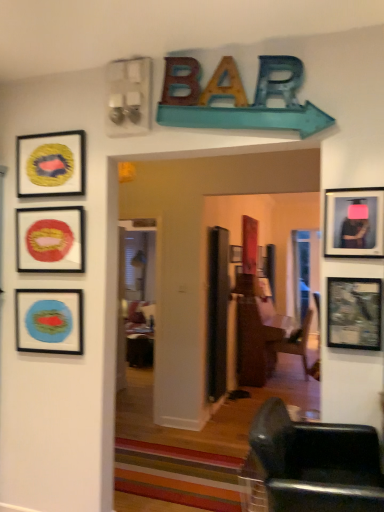
Image resolution: width=384 pixels, height=512 pixels. What are the coordinates of `matte red circular object at upper left, the 2th picture frame in the left-to-right sequence` in the screenshot? It's located at (50, 240).

You are a GUI agent. You are given a task and a screenshot of the screen. Output one action in this format:
    pyautogui.click(x=<x>, y=<y>)
    Task: Click on the matte black picture frame at center, which is counted as the first picture frame, starting from the back
    This screenshot has width=384, height=512.
    Given the screenshot: What is the action you would take?
    pyautogui.click(x=235, y=254)

Locate an element on the screen. wooden framed map at right, positioned as the fifth picture frame in left-to-right order is located at coordinates pyautogui.click(x=354, y=313).

Where is `matte red circular object at upper left, which is the 5th picture frame in right-to-left order`? The height and width of the screenshot is (512, 384). matte red circular object at upper left, which is the 5th picture frame in right-to-left order is located at coordinates (50, 240).

Which is less distant, (289, 470) or (221, 475)?

The point (289, 470) is closer.

Considering the sizes of objects black leather chair at lower right and wooden striped rug at center in the image provided, who is wider, black leather chair at lower right or wooden striped rug at center?

wooden striped rug at center.

From the picture: Is black leather chair at lower right bigger or smaller than wooden striped rug at center?

black leather chair at lower right is bigger than wooden striped rug at center.

In the scene shown: Does black leather chair at lower right turn towards wooden striped rug at center?

No, black leather chair at lower right is not oriented towards wooden striped rug at center.

Is brown wooden door at center far from matte blue picture frame at left, acting as the fourth picture frame starting from the front?

That's right, there is a large distance between brown wooden door at center and matte blue picture frame at left, acting as the fourth picture frame starting from the front.

Where is `door located underneath the matte blue picture frame at left, acting as the fourth picture frame starting from the front (from a real-world perspective)`? This screenshot has height=512, width=384. door located underneath the matte blue picture frame at left, acting as the fourth picture frame starting from the front (from a real-world perspective) is located at coordinates (217, 312).

Who is smaller, brown wooden door at center or matte blue picture frame at left, arranged as the first picture frame when viewed from the left?

matte blue picture frame at left, arranged as the first picture frame when viewed from the left, is smaller.

From a real-world perspective, which object rests below the other?

In real-world perspective, brown wooden door at center is lower.

Can you confirm if metallic silver television at right, which is counted as the 6th picture frame, starting from the back, is bigger than black leather chair at lower right?

Incorrect, metallic silver television at right, which is counted as the 6th picture frame, starting from the back, is not larger than black leather chair at lower right.

Is metallic silver television at right, which appears as the 6th picture frame when viewed from the left, at the left side of black leather chair at lower right?

Incorrect, metallic silver television at right, which appears as the 6th picture frame when viewed from the left, is not on the left side of black leather chair at lower right.

Does metallic silver television at right, the 1th picture frame when ordered from right to left, turn towards black leather chair at lower right?

No, metallic silver television at right, the 1th picture frame when ordered from right to left, is not facing towards black leather chair at lower right.

Considering the positions of objects black leather chair at lower right and yellow matte painting at upper left, positioned as the 3th picture frame in left-to-right order, in the image provided, who is behind, black leather chair at lower right or yellow matte painting at upper left, positioned as the 3th picture frame in left-to-right order,?

yellow matte painting at upper left, positioned as the 3th picture frame in left-to-right order, is behind.

Is black leather chair at lower right with yellow matte painting at upper left, positioned as the 3th picture frame in left-to-right order?

They are not placed beside each other.

Is black leather chair at lower right completely or partially outside of yellow matte painting at upper left, which is counted as the 4th picture frame, starting from the right?

Indeed, black leather chair at lower right is completely outside yellow matte painting at upper left, which is counted as the 4th picture frame, starting from the right.

How different are the orientations of black leather chair at lower right and yellow matte painting at upper left, which is counted as the 4th picture frame, starting from the right, in degrees?

The angular difference between black leather chair at lower right and yellow matte painting at upper left, which is counted as the 4th picture frame, starting from the right, is 90 degrees.

Considering the relative positions of transparent glass door at center and matte blue picture frame at left, arranged as the first picture frame when viewed from the left, in the image provided, is transparent glass door at center to the right of matte blue picture frame at left, arranged as the first picture frame when viewed from the left, from the viewer's perspective?

Yes, transparent glass door at center is to the right of matte blue picture frame at left, arranged as the first picture frame when viewed from the left.

From the image's perspective, is transparent glass door at center over matte blue picture frame at left, arranged as the first picture frame when viewed from the left?

No.

Is transparent glass door at center oriented towards matte blue picture frame at left, positioned as the sixth picture frame in right-to-left order?

Yes, transparent glass door at center is aimed at matte blue picture frame at left, positioned as the sixth picture frame in right-to-left order.

In terms of height, does transparent glass door at center look taller or shorter compared to matte blue picture frame at left, arranged as the first picture frame when viewed from the left?

Clearly, transparent glass door at center is taller compared to matte blue picture frame at left, arranged as the first picture frame when viewed from the left.

Is matte red circular object at upper left, which is the 4th picture frame from back to front, oriented away from brown wooden door at center?

Yes, brown wooden door at center is at the back of matte red circular object at upper left, which is the 4th picture frame from back to front.

What's the angular difference between matte red circular object at upper left, which is the 4th picture frame from back to front, and brown wooden door at center's facing directions?

The facing directions of matte red circular object at upper left, which is the 4th picture frame from back to front, and brown wooden door at center are 91.2 degrees apart.

Which is in front, matte red circular object at upper left, arranged as the 3th picture frame when viewed from the front, or brown wooden door at center?

matte red circular object at upper left, arranged as the 3th picture frame when viewed from the front.

Can you confirm if matte red circular object at upper left, which is the 4th picture frame from back to front, is bigger than brown wooden door at center?

Incorrect, matte red circular object at upper left, which is the 4th picture frame from back to front, is not larger than brown wooden door at center.

Does point (45, 336) lie behind point (381, 480)?

Yes, point (45, 336) is farther from viewer.

Is matte blue picture frame at left, acting as the fourth picture frame starting from the front, smaller than black leather chair at lower right?

Correct, matte blue picture frame at left, acting as the fourth picture frame starting from the front, occupies less space than black leather chair at lower right.

Is matte blue picture frame at left, positioned as the sixth picture frame in right-to-left order, in contact with black leather chair at lower right?

No, matte blue picture frame at left, positioned as the sixth picture frame in right-to-left order, is not in contact with black leather chair at lower right.

Where is `plain lying behind the black leather chair at lower right`? plain lying behind the black leather chair at lower right is located at coordinates (177, 475).

From the brown wooden door at center, count the 3rd picture frame to the left and point to it. Please provide its 2D coordinates.

[(49, 321)]

Which object lies nearer to the anchor point transparent glass door at center, wooden striped rug at center or brown wooden door at center?

Based on the image, brown wooden door at center appears to be nearer to transparent glass door at center.

From the image, which object appears to be nearer to transparent glass door at center, matte red circular object at upper left, which is the 5th picture frame in right-to-left order, or metallic silver television at right, the 1th picture frame in the front-to-back sequence?

matte red circular object at upper left, which is the 5th picture frame in right-to-left order, is closer to transparent glass door at center.

Which object lies further to the anchor point black leather chair at lower right, brown wooden door at center or matte red circular object at upper left, arranged as the 3th picture frame when viewed from the front?

brown wooden door at center is further to black leather chair at lower right.

When comparing their distances from matte blue picture frame at left, acting as the fourth picture frame starting from the front, does transparent glass door at center or wooden striped rug at center seem further?

transparent glass door at center is positioned further to the anchor matte blue picture frame at left, acting as the fourth picture frame starting from the front.

Looking at the image, which one is located closer to wooden striped rug at center, metallic silver television at right, the 1th picture frame when ordered from right to left, or matte blue picture frame at left, positioned as the sixth picture frame in right-to-left order?

matte blue picture frame at left, positioned as the sixth picture frame in right-to-left order, lies closer to wooden striped rug at center than the other object.

Which object lies further to the anchor point wooden striped rug at center, metallic silver television at right, the 1th picture frame in the front-to-back sequence, or yellow matte painting at upper left, which is the 2th picture frame in back-to-front order?

yellow matte painting at upper left, which is the 2th picture frame in back-to-front order, lies further to wooden striped rug at center than the other object.

Consider the image. Considering their positions, is matte black picture frame at center, which is counted as the first picture frame, starting from the back, positioned closer to matte blue picture frame at left, arranged as the first picture frame when viewed from the left, than matte red circular object at upper left, the 2th picture frame in the left-to-right sequence?

matte red circular object at upper left, the 2th picture frame in the left-to-right sequence, is positioned closer to the anchor matte blue picture frame at left, arranged as the first picture frame when viewed from the left.

When comparing their distances from wooden striped rug at center, does wooden framed map at right, arranged as the second picture frame when viewed from the right, or black leather chair at lower right seem closer?

black leather chair at lower right.

Identify the location of glass door located between matte red circular object at upper left, which is the 4th picture frame from back to front, and brown wooden door at center in the depth direction. This screenshot has height=512, width=384. (135, 296).

At what (x,y) coordinates should I click in order to perform the action: click on door between black leather chair at lower right and matte black picture frame at center, which appears as the fourth picture frame when viewed from the left, along the z-axis. Please return your answer as a coordinate pair (x, y). Looking at the image, I should click on (217, 312).

Image resolution: width=384 pixels, height=512 pixels. What are the coordinates of `door positioned between yellow matte painting at upper left, the 5th picture frame from the front, and matte black picture frame at center, which is counted as the first picture frame, starting from the back, from near to far` in the screenshot? It's located at (217, 312).

The image size is (384, 512). In order to click on picture frame between matte blue picture frame at left, arranged as the first picture frame when viewed from the left, and brown wooden door at center in the front-back direction in this screenshot , I will do `click(51, 164)`.